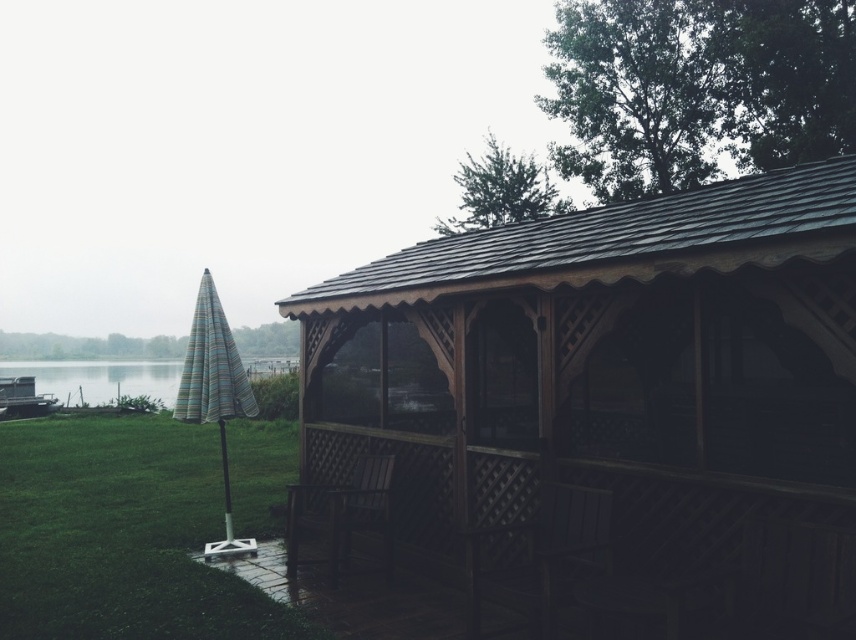
Question: Can you confirm if wooden lattice porch at center is smaller than striped fabric umbrella at left?

Choices:
 (A) yes
 (B) no

Answer: (A)

Question: Which point is farther to the camera?

Choices:
 (A) (373, 477)
 (B) (134, 502)
 (C) (842, 602)
 (D) (215, 552)

Answer: (B)

Question: Where is wooden gazebo at center located in relation to blue striped umbrella at left in the image?

Choices:
 (A) right
 (B) left

Answer: (A)

Question: Which of the following is the closest to the observer?

Choices:
 (A) (383, 467)
 (B) (631, 260)
 (C) (42, 364)

Answer: (B)

Question: Which object is closer to the camera taking this photo?

Choices:
 (A) brown wooden picnic table at lower center
 (B) wooden lattice porch at center
 (C) blue striped umbrella at left
 (D) green grass at lower left

Answer: (B)

Question: Does brown wooden picnic table at lower center appear under blue striped umbrella at left?

Choices:
 (A) no
 (B) yes

Answer: (A)